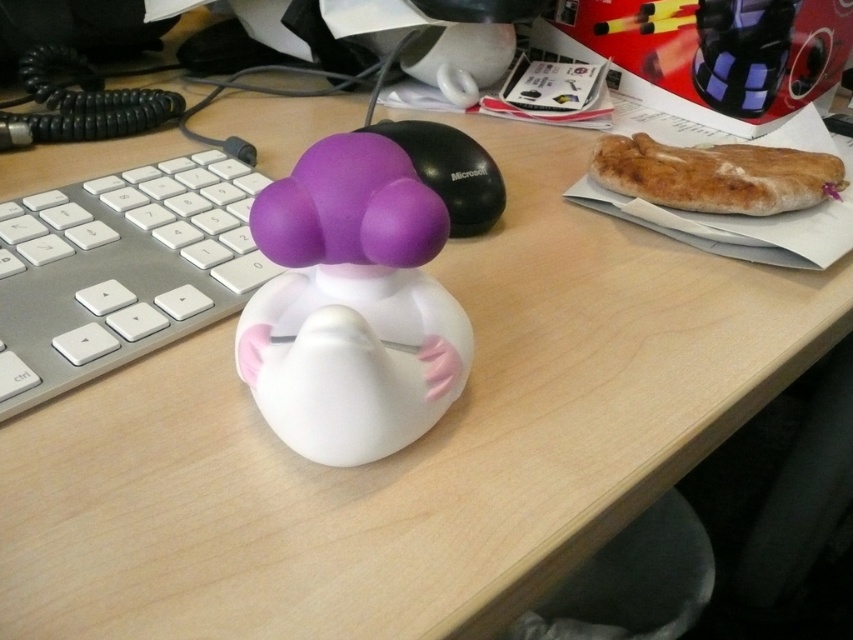
Looking at this image, is matte rubber duck at center further to camera compared to silver metallic keyboard at center-left?

No, matte rubber duck at center is in front of silver metallic keyboard at center-left.

The width and height of the screenshot is (853, 640). Find the location of `matte rubber duck at center`. matte rubber duck at center is located at coordinates (351, 305).

Between point (335, 376) and point (3, 317), which one is positioned behind?

Positioned behind is point (3, 317).

At what (x,y) coordinates should I click in order to perform the action: click on matte rubber duck at center. Please return your answer as a coordinate pair (x, y). Looking at the image, I should click on (351, 305).

Which is more to the left, matte rubber duck at center or bread crusty at right?

From the viewer's perspective, matte rubber duck at center appears more on the left side.

Is point (331, 362) farther from camera compared to point (772, 186)?

No, it is in front of (772, 186).

Is point (300, 321) closer to camera compared to point (653, 173)?

Yes, point (300, 321) is in front of point (653, 173).

Where is `matte rubber duck at center`? Image resolution: width=853 pixels, height=640 pixels. matte rubber duck at center is located at coordinates (351, 305).

Which is more to the right, silver metallic keyboard at center-left or bread crusty at right?

Positioned to the right is bread crusty at right.

Is silver metallic keyboard at center-left shorter than bread crusty at right?

In fact, silver metallic keyboard at center-left may be taller than bread crusty at right.

Does point (140, 282) lie in front of point (820, 188)?

Yes, point (140, 282) is in front of point (820, 188).

This screenshot has height=640, width=853. I want to click on silver metallic keyboard at center-left, so point(120,269).